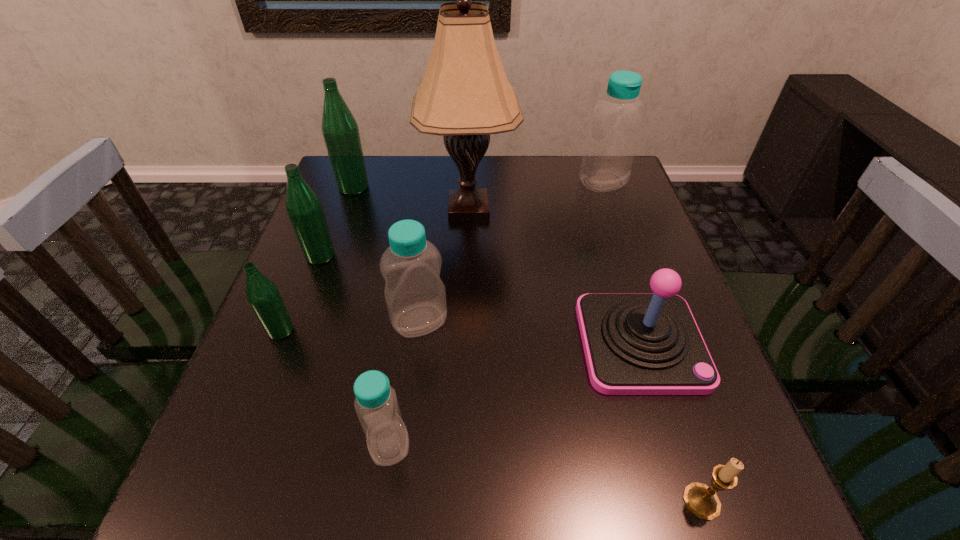
Image resolution: width=960 pixels, height=540 pixels. In order to click on the smallest blue bottle in this screenshot , I will do `click(376, 404)`.

Find the location of `the eighth farthest object`. the eighth farthest object is located at coordinates (376, 404).

The image size is (960, 540). I want to click on candle holder, so click(x=702, y=501).

This screenshot has height=540, width=960. Find the location of `the nearest object`. the nearest object is located at coordinates (702, 501).

At what (x,y) coordinates should I click in order to perform the action: click on free space located on the left of the lamp. Please return your answer as a coordinate pair (x, y). This screenshot has width=960, height=540. Looking at the image, I should click on (380, 208).

You are a GUI agent. You are given a task and a screenshot of the screen. Output one action in this format:
    pyautogui.click(x=<x>, y=<y>)
    Task: Click on the vacant region located 0.070m on the back of the rightmost blue bottle
    This screenshot has height=540, width=960.
    Given the screenshot: What is the action you would take?
    pyautogui.click(x=594, y=159)

What are the coordinates of `vacant space located on the right of the biggest green bottle` in the screenshot? It's located at (422, 187).

You are a GUI agent. You are given a task and a screenshot of the screen. Output one action in this format:
    pyautogui.click(x=<x>, y=<y>)
    Task: Click on the free location located on the back of the second smallest green bottle
    This screenshot has width=960, height=540.
    Given the screenshot: What is the action you would take?
    pyautogui.click(x=333, y=222)

The width and height of the screenshot is (960, 540). Identify the location of free space located 0.080m on the left of the second nearest blue bottle. (352, 321).

Locate an element on the screen. The height and width of the screenshot is (540, 960). free space located forward from the base of the joystick is located at coordinates (665, 422).